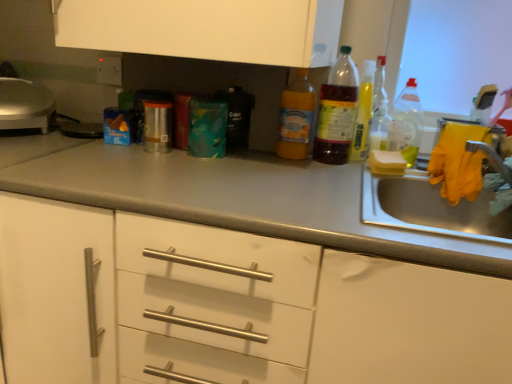
Image resolution: width=512 pixels, height=384 pixels. I want to click on vacant space to the left of white sponge at sink, so tap(325, 168).